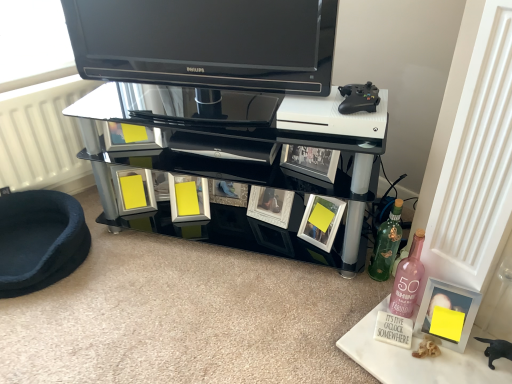
Find the location of `free spot to the left of green glass bottle at lower right, acting as the 2th bottle starting from the front`. free spot to the left of green glass bottle at lower right, acting as the 2th bottle starting from the front is located at coordinates (339, 283).